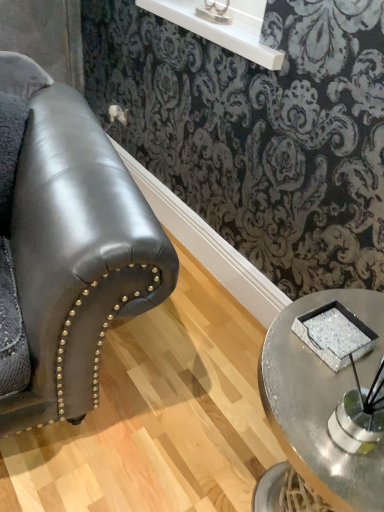
Question: Does point (140, 5) appear closer or farther from the camera than point (354, 322)?

Choices:
 (A) farther
 (B) closer

Answer: (A)

Question: In terms of height, does white glossy shelf at upper center look taller or shorter compared to sparkly silver tray at center?

Choices:
 (A) tall
 (B) short

Answer: (B)

Question: Which object is positioned closest to the white glossy shelf at upper center?

Choices:
 (A) metallic silver tray at lower right
 (B) metallic silver table lamp at upper center
 (C) sparkly silver tray at center

Answer: (B)

Question: Considering the real-world distances, which object is closest to the white glossy shelf at upper center?

Choices:
 (A) metallic silver table lamp at upper center
 (B) metallic silver tray at lower right
 (C) sparkly silver tray at center

Answer: (A)